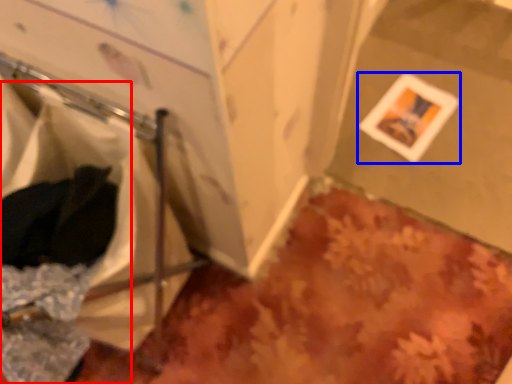
Question: Which point is closer to the camera, laundry (highlighted by a red box) or picture frame (highlighted by a blue box)?

Choices:
 (A) laundry
 (B) picture frame

Answer: (A)